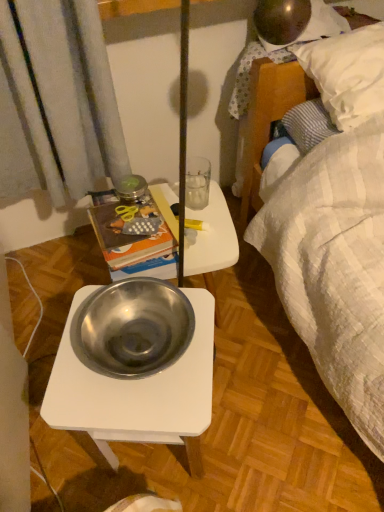
The height and width of the screenshot is (512, 384). What are the coordinates of `free space above hardcover book at upper left (from a real-world perspective)` in the screenshot? It's located at (130, 218).